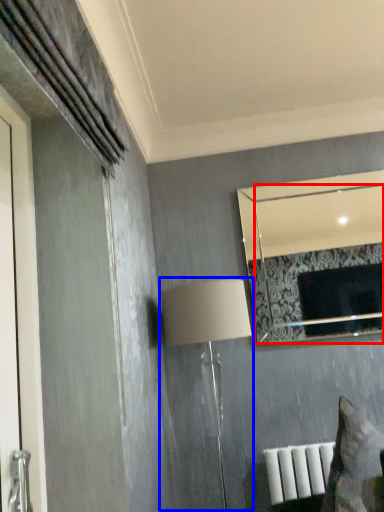
Question: Which of the following is the farthest to the observer, mirror (highlighted by a red box) or table lamp (highlighted by a blue box)?

Choices:
 (A) mirror
 (B) table lamp

Answer: (A)